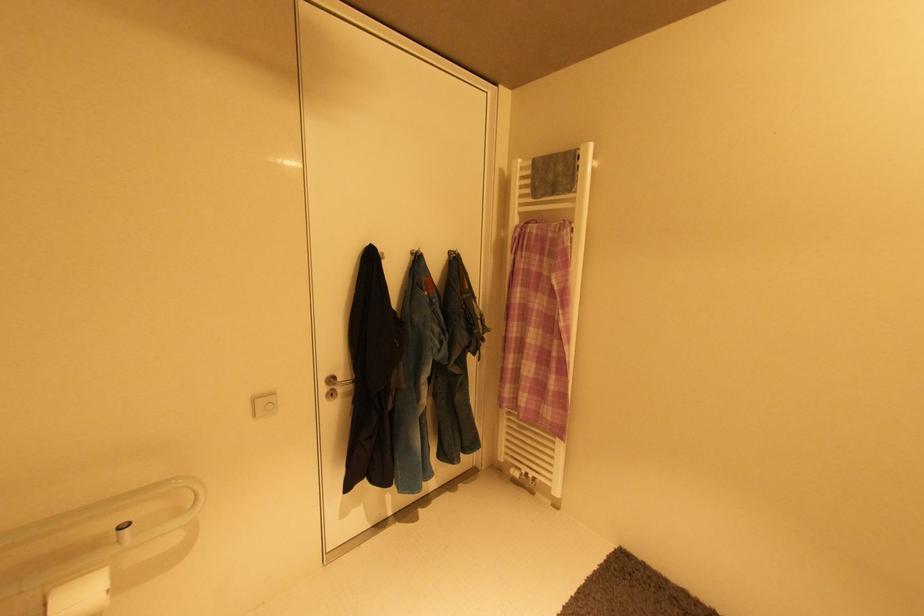
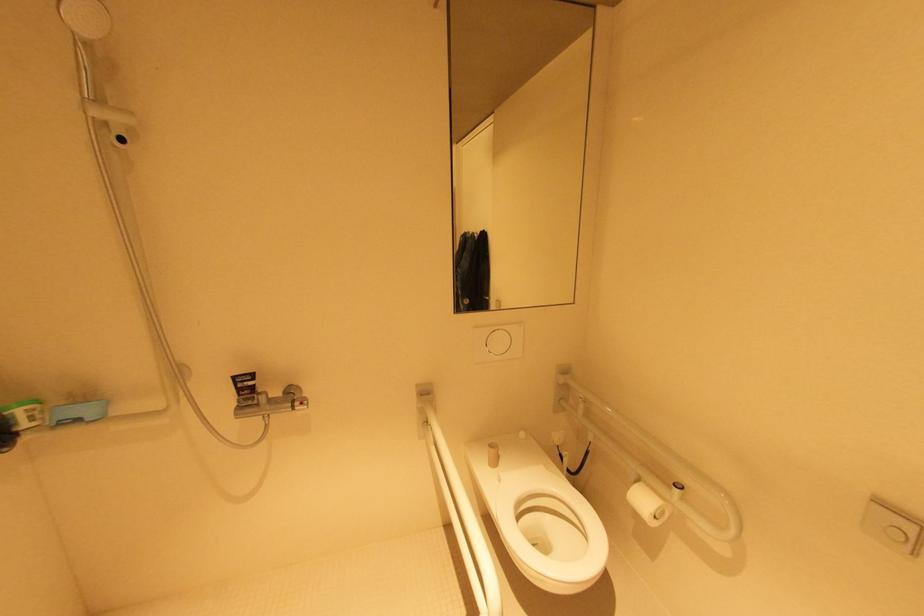
The first image is from the beginning of the video and the second image is from the end. How did the camera likely rotate when shooting the video?

The rotation direction of the camera is left-down.